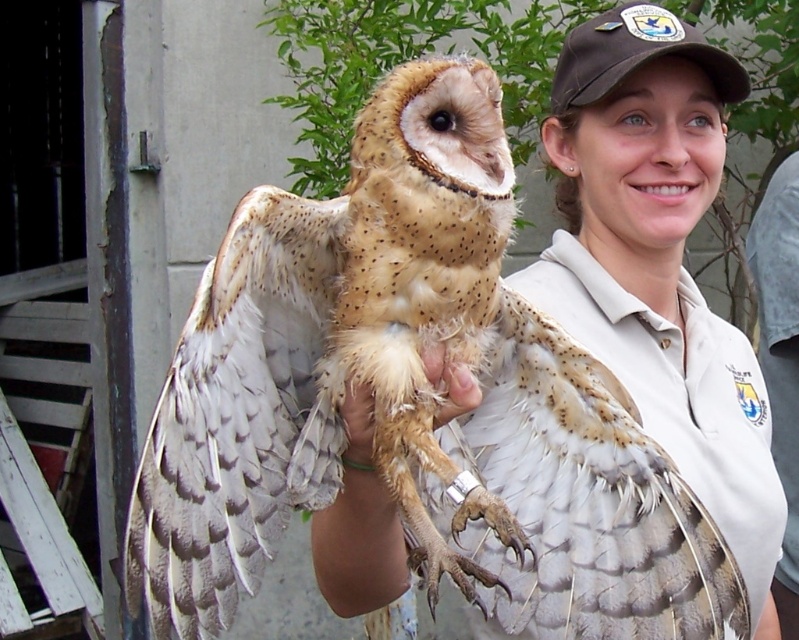
Question: Is speckled feathered owl at center below fuzzy beige feathers at center?

Choices:
 (A) no
 (B) yes

Answer: (B)

Question: Among these objects, which one is farthest from the camera?

Choices:
 (A) speckled feathered owl at center
 (B) fuzzy beige feathers at center

Answer: (B)

Question: Is speckled feathered owl at center to the right of fuzzy beige feathers at center from the viewer's perspective?

Choices:
 (A) no
 (B) yes

Answer: (B)

Question: Is speckled feathered owl at center positioned at the back of fuzzy beige feathers at center?

Choices:
 (A) no
 (B) yes

Answer: (A)

Question: Which object appears closest to the camera in this image?

Choices:
 (A) fuzzy beige feathers at center
 (B) speckled feathered owl at center

Answer: (B)